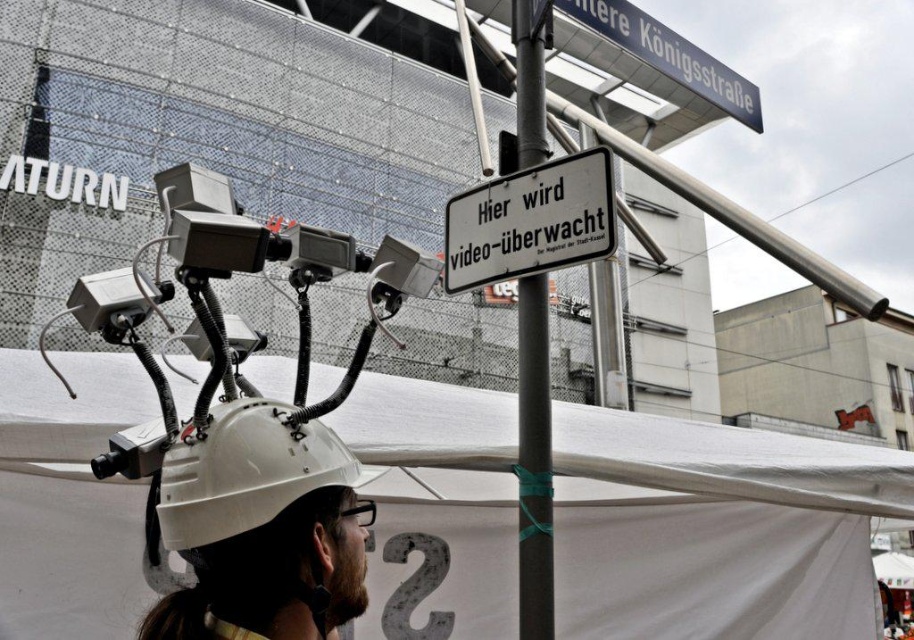
Which of these two, white plastic sign at upper center or blue metallic street sign at upper center, stands shorter?

white plastic sign at upper center

Can you confirm if white plastic sign at upper center is shorter than blue metallic street sign at upper center?

Yes, white plastic sign at upper center is shorter than blue metallic street sign at upper center.

This screenshot has width=914, height=640. Describe the element at coordinates (530, 221) in the screenshot. I see `white plastic sign at upper center` at that location.

At what (x,y) coordinates should I click in order to perform the action: click on white plastic sign at upper center. Please return your answer as a coordinate pair (x, y). Looking at the image, I should click on (530, 221).

Does white fabric tent at center appear on the right side of white plastic sign at upper center?

Indeed, white fabric tent at center is positioned on the right side of white plastic sign at upper center.

Who is positioned more to the right, white fabric tent at center or white plastic sign at upper center?

From the viewer's perspective, white fabric tent at center appears more on the right side.

What do you see at coordinates (715, 529) in the screenshot? The image size is (914, 640). I see `white fabric tent at center` at bounding box center [715, 529].

In order to click on white fabric tent at center in this screenshot , I will do `click(715, 529)`.

Is white hard hat at center to the right of white plastic sign at upper center from the viewer's perspective?

In fact, white hard hat at center is to the left of white plastic sign at upper center.

Is white hard hat at center further to the viewer compared to white plastic sign at upper center?

No, white hard hat at center is in front of white plastic sign at upper center.

In the scene shown: Measure the distance between point (301, 468) and camera.

Point (301, 468) and camera are 3.82 feet apart from each other.

Image resolution: width=914 pixels, height=640 pixels. I want to click on white hard hat at center, so click(x=259, y=528).